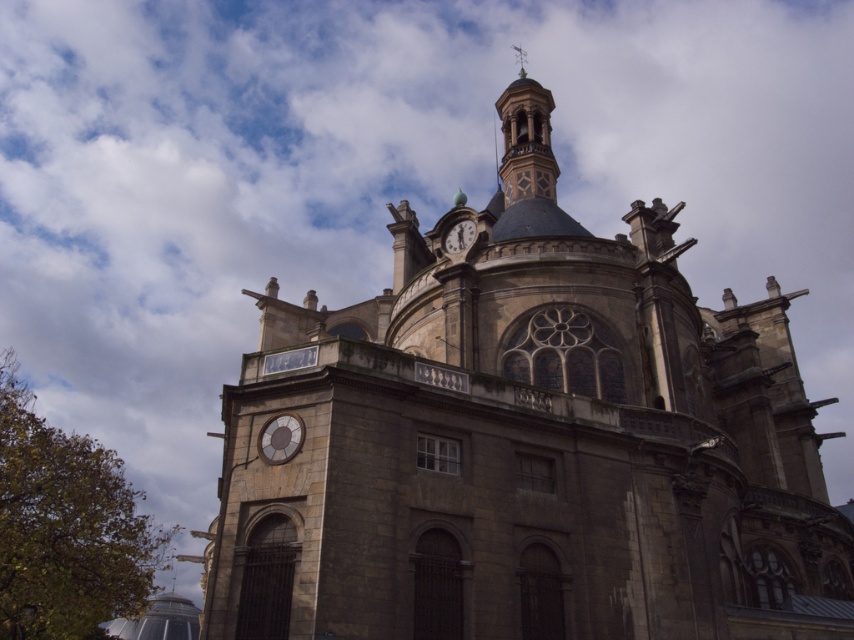
Question: Which is farther from the matte gray clock at lower left?

Choices:
 (A) smooth stone clock tower at upper center
 (B) stone church at center

Answer: (A)

Question: Which point appears closest to the camera in this image?

Choices:
 (A) (471, 234)
 (B) (515, 92)

Answer: (A)

Question: Does smooth stone clock tower at upper center appear on the right side of matte stone clock at upper center?

Choices:
 (A) no
 (B) yes

Answer: (B)

Question: In this image, where is smooth stone clock tower at upper center located relative to matte stone clock at upper center?

Choices:
 (A) right
 (B) left

Answer: (A)

Question: Estimate the real-world distances between objects in this image. Which object is closer to the matte gray clock at lower left?

Choices:
 (A) stone church at center
 (B) smooth stone clock tower at upper center

Answer: (A)

Question: Can you confirm if stone church at center is positioned above matte gray clock at lower left?

Choices:
 (A) no
 (B) yes

Answer: (A)